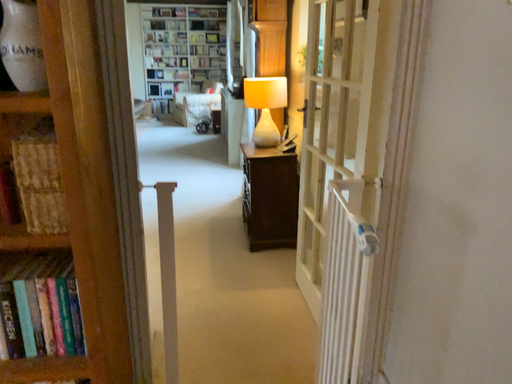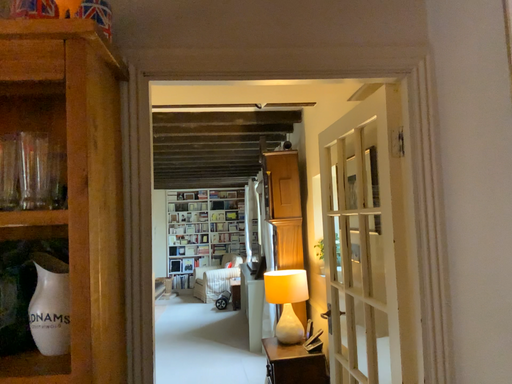
Question: Which way did the camera rotate in the video?

Choices:
 (A) rotated upward
 (B) rotated downward

Answer: (A)